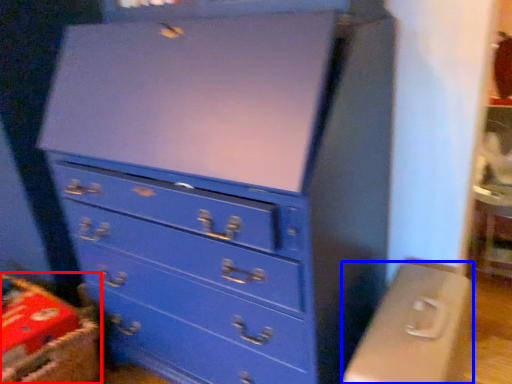
Question: Which of the following is the farthest to the observer, crate (highlighted by a red box) or computer desk (highlighted by a blue box)?

Choices:
 (A) crate
 (B) computer desk

Answer: (A)